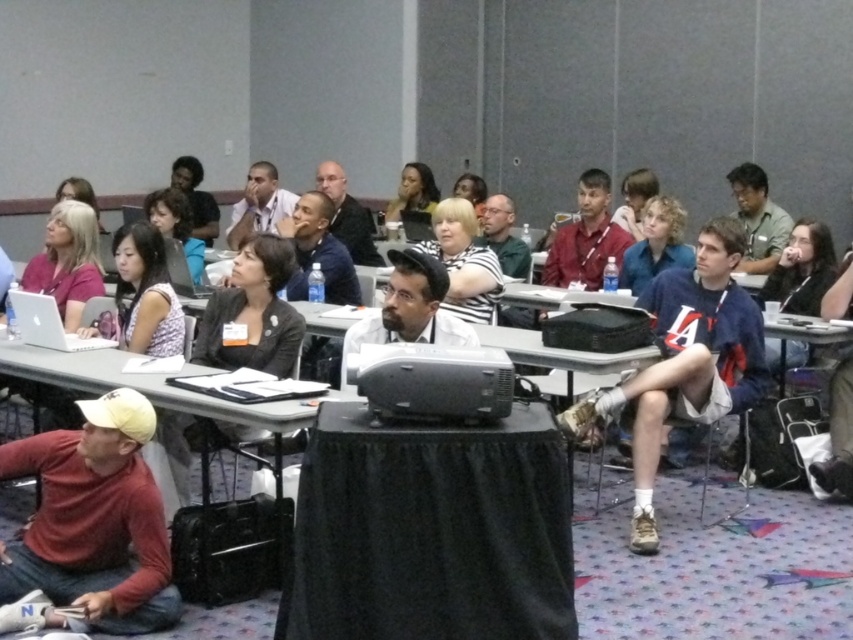
Question: Considering the real-world distances, which object is closest to the matte red shirt at center?

Choices:
 (A) matte pink shirt at left
 (B) black fabric table at center
 (C) matte red shirt at lower left
 (D) blue cotton shirt at center

Answer: (D)

Question: Among these objects, which one is farthest from the camera?

Choices:
 (A) black fabric table at center
 (B) blue shirt at center
 (C) matte red shirt at lower left

Answer: (B)

Question: Can you confirm if matte pink shirt at left is positioned to the right of dark blue jersey at right?

Choices:
 (A) no
 (B) yes

Answer: (A)

Question: Which of the following is the farthest from the observer?

Choices:
 (A) (61, 234)
 (B) (838, 289)

Answer: (A)

Question: Can you confirm if black fabric table at center is smaller than white striped shirt at center?

Choices:
 (A) no
 (B) yes

Answer: (A)

Question: Can you confirm if white striped shirt at center is smaller than green matte shirt at upper right?

Choices:
 (A) yes
 (B) no

Answer: (A)